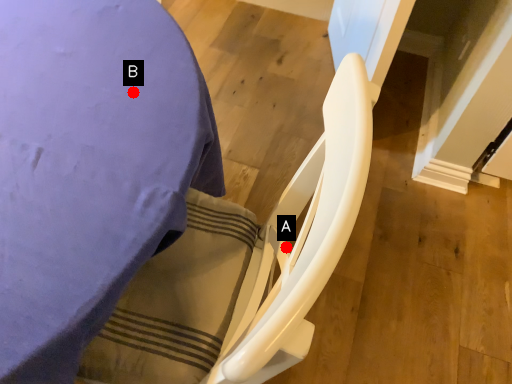
Question: Two points are circled on the image, labeled by A and B beside each circle. Which of the following is the farthest from the observer?

Choices:
 (A) A is further
 (B) B is further

Answer: (A)